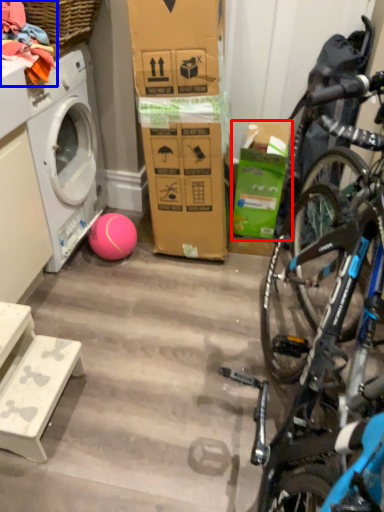
Question: Among these objects, which one is farthest to the camera, box (highlighted by a red box) or clothing (highlighted by a blue box)?

Choices:
 (A) box
 (B) clothing

Answer: (A)